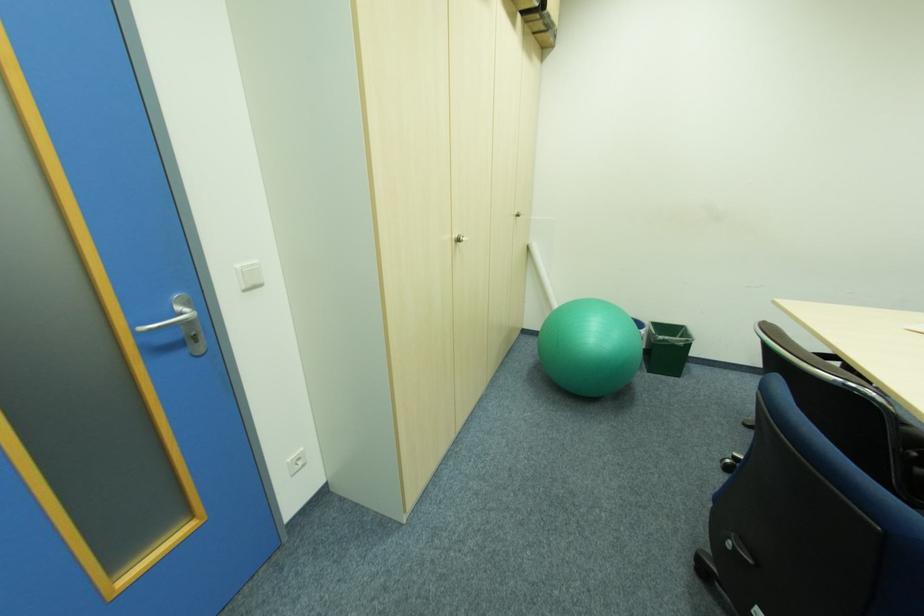
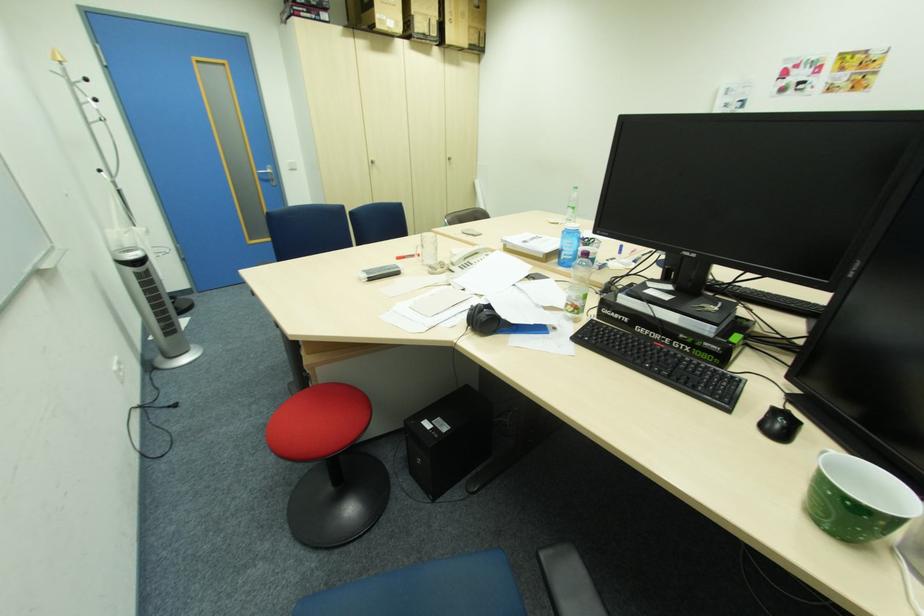
Where in the second image is the point corresponding to (x=144, y=334) from the first image?

(264, 174)